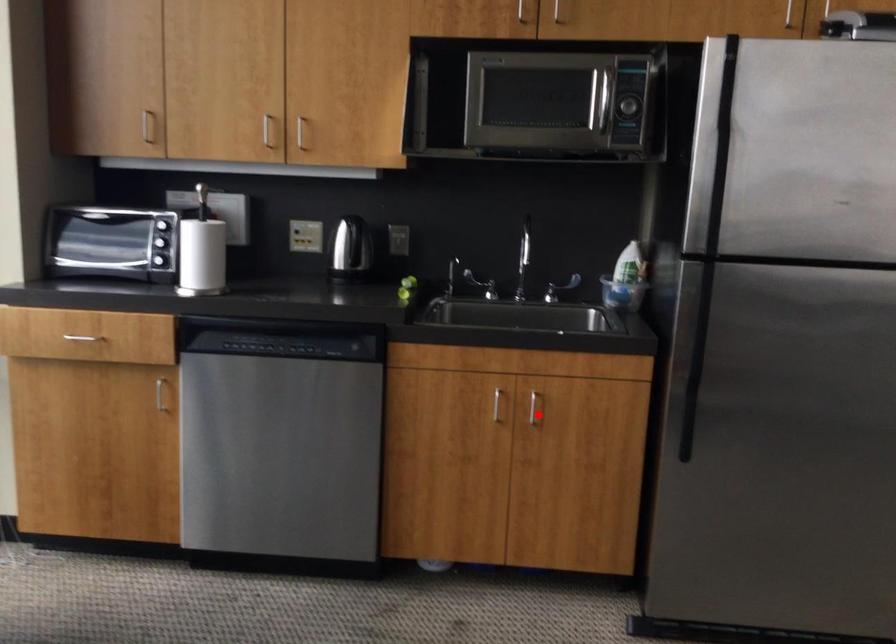
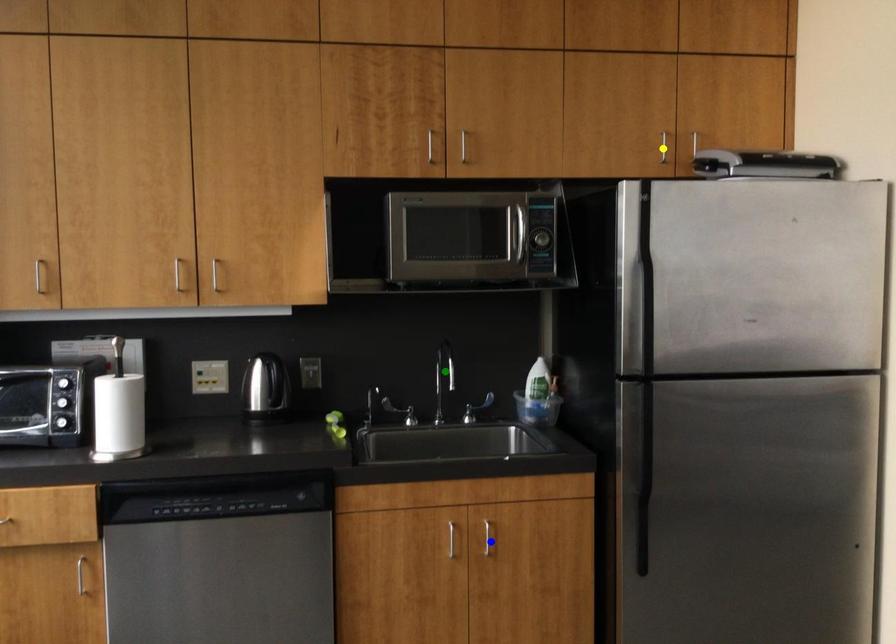
Question: I am providing you with two images of the same scene from different viewpoints. A red point is marked on the first image. You are given multiple points on the second image. Which spot in image 2 lines up with the point in image 1?

Choices:
 (A) blue point
 (B) green point
 (C) yellow point

Answer: (A)